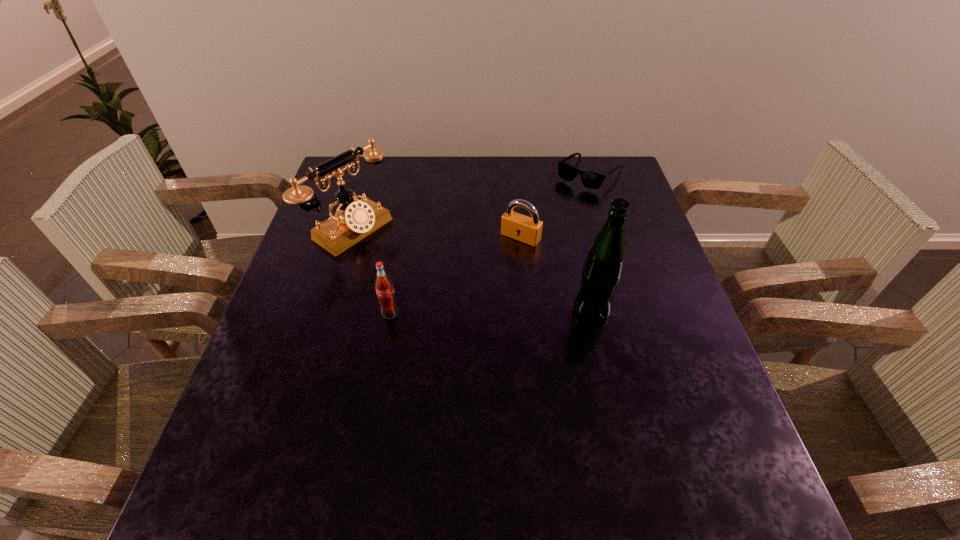
This screenshot has width=960, height=540. Find the location of `vacant space located on the front of the beer bottle`. vacant space located on the front of the beer bottle is located at coordinates (615, 420).

Where is `free point located on the dial of the telephone`? Image resolution: width=960 pixels, height=540 pixels. free point located on the dial of the telephone is located at coordinates (471, 309).

I want to click on vacant area located 0.170m on the dial of the telephone, so (424, 279).

Find the location of `blank area located on the dial of the telephone`. blank area located on the dial of the telephone is located at coordinates (415, 273).

Where is `free space located 0.370m to unlock the fourth tallest object from the front`? This screenshot has width=960, height=540. free space located 0.370m to unlock the fourth tallest object from the front is located at coordinates (431, 347).

This screenshot has height=540, width=960. Find the location of `free point located 0.350m to unlock the fourth tallest object from the front`. free point located 0.350m to unlock the fourth tallest object from the front is located at coordinates (436, 340).

You are a GUI agent. You are given a task and a screenshot of the screen. Output one action in this format:
    pyautogui.click(x=<x>, y=<y>)
    Task: Click on the free location located 0.130m to unlock the fourth tallest object from the front
    
    Given the screenshot: What is the action you would take?
    pyautogui.click(x=487, y=277)

The height and width of the screenshot is (540, 960). In order to click on vacant position located on the front-facing side of the shortest object in this screenshot , I will do `click(568, 198)`.

Image resolution: width=960 pixels, height=540 pixels. What are the coordinates of `vacant space situated 0.280m on the front-facing side of the shortest object` in the screenshot? It's located at (531, 241).

Where is `vacant space located 0.100m on the front-facing side of the shortest object`? This screenshot has width=960, height=540. vacant space located 0.100m on the front-facing side of the shortest object is located at coordinates (561, 206).